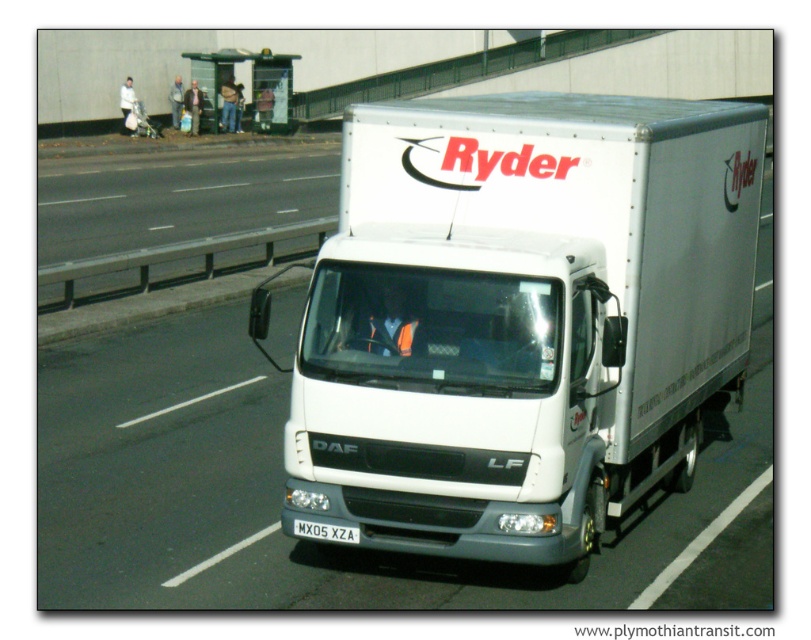
You are a photographer trying to capture the white matte truck at center and the white plastic license plate at center in a single shot. Given their sizes, which object will appear bigger in your photo?

The white matte truck at center will appear bigger in the photo because it has a larger size compared to the white plastic license plate at center.

You are a delivery driver who needs to check if your white matte truck at center can fit under a low bridge that has a height limit of 4 meters. The license plate on your truck, white plastic license plate at center, is 0.3 meters in height. Can you estimate whether your truck will pass under the bridge?

The white matte truck at center is taller than the white plastic license plate at center, which is 0.3 meters in height. Since the truck is taller than the license plate, but the exact height of the truck isn

You are a pedestrian standing at the bus stop shelter. The white matte truck at center is driving towards you. If the truck is moving at 15 km per hour, how long will it take for the truck to reach your position?

The white matte truck at center and viewer are 6.45 meters apart from each other. At 15 km per hour, the truck travels 4.1667 meters per second. 6.45 meters divided by 4.1667 meters per second equals approximately 1.55 seconds. So the truck will reach the position in about 1.55 seconds.